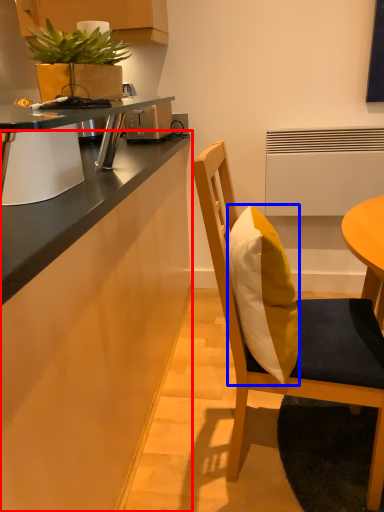
Question: Which object is further to the camera taking this photo, cabinetry (highlighted by a red box) or pillow (highlighted by a blue box)?

Choices:
 (A) cabinetry
 (B) pillow

Answer: (B)